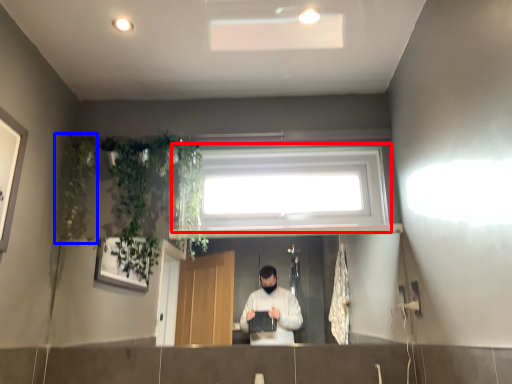
Question: Among these objects, which one is nearest to the camera, window (highlighted by a red box) or plant (highlighted by a blue box)?

Choices:
 (A) window
 (B) plant

Answer: (B)